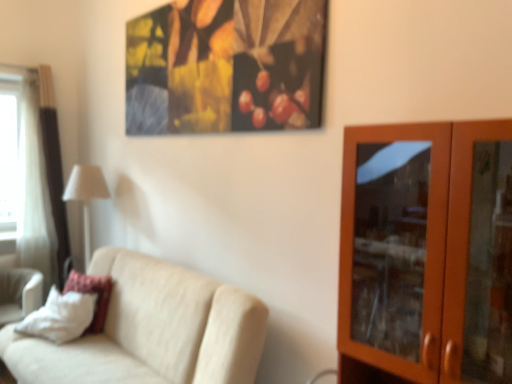
Question: Does white fabric lampshade at left lie behind white sheer curtain at left?

Choices:
 (A) no
 (B) yes

Answer: (A)

Question: Can you confirm if white fabric lampshade at left is thinner than white sheer curtain at left?

Choices:
 (A) yes
 (B) no

Answer: (B)

Question: Are white fabric lampshade at left and white sheer curtain at left beside each other?

Choices:
 (A) yes
 (B) no

Answer: (B)

Question: Is white fabric lampshade at left smaller than white sheer curtain at left?

Choices:
 (A) no
 (B) yes

Answer: (B)

Question: Is white sheer curtain at left at the back of white fabric lampshade at left?

Choices:
 (A) no
 (B) yes

Answer: (A)

Question: Does white fabric lampshade at left have a greater height compared to white sheer curtain at left?

Choices:
 (A) no
 (B) yes

Answer: (A)

Question: Does white fabric lampshade at left come behind brown wooden cabinet at right?

Choices:
 (A) yes
 (B) no

Answer: (A)

Question: Is white fabric lampshade at left at the right side of brown wooden cabinet at right?

Choices:
 (A) yes
 (B) no

Answer: (B)

Question: Does white fabric lampshade at left have a lesser width compared to brown wooden cabinet at right?

Choices:
 (A) no
 (B) yes

Answer: (B)

Question: Is white fabric lampshade at left looking in the opposite direction of brown wooden cabinet at right?

Choices:
 (A) no
 (B) yes

Answer: (A)

Question: From the image's perspective, is white fabric lampshade at left over brown wooden cabinet at right?

Choices:
 (A) no
 (B) yes

Answer: (B)

Question: From the image's perspective, is white fabric lampshade at left located beneath brown wooden cabinet at right?

Choices:
 (A) yes
 (B) no

Answer: (B)

Question: Does white soft pillow at lower left appear on the right side of brown wooden cabinet at right?

Choices:
 (A) yes
 (B) no

Answer: (B)